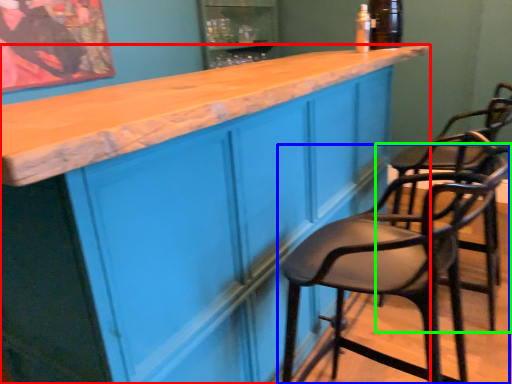
Question: Considering the real-world distances, which object is closest to cabinetry (highlighted by a red box)? chair (highlighted by a blue box) or chair (highlighted by a green box).

Choices:
 (A) chair
 (B) chair

Answer: (A)